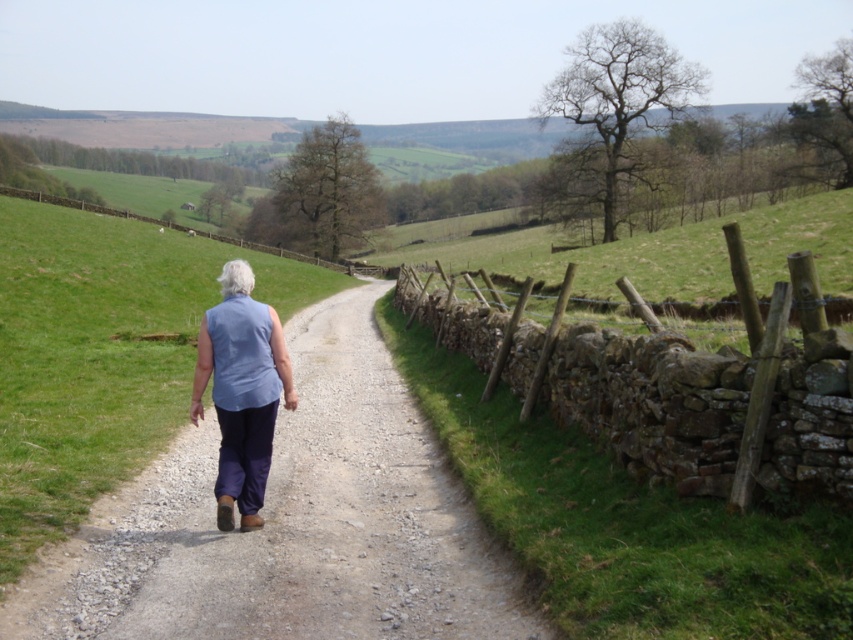
Based on the photo, who is more forward, (740,438) or (258,388)?

Point (740,438) is more forward.

Does brown stone fence at right lie in front of blue fabric at center?

That is True.

Who is more forward, (x=509, y=369) or (x=209, y=356)?

Positioned in front is point (x=209, y=356).

The height and width of the screenshot is (640, 853). Find the location of `brown stone fence at right`. brown stone fence at right is located at coordinates (663, 394).

Can you confirm if dusty gravel path at center is shorter than brown stone fence at right?

Yes, dusty gravel path at center is shorter than brown stone fence at right.

Does dusty gravel path at center have a smaller size compared to brown stone fence at right?

Correct, dusty gravel path at center occupies less space than brown stone fence at right.

Is point (442, 500) positioned before point (520, 321)?

That is True.

Identify the location of dusty gravel path at center. The width and height of the screenshot is (853, 640). [x=289, y=524].

The width and height of the screenshot is (853, 640). What do you see at coordinates (289, 524) in the screenshot?
I see `dusty gravel path at center` at bounding box center [289, 524].

Does dusty gravel path at center have a greater height compared to blue fabric at center?

No.

You are a GUI agent. You are given a task and a screenshot of the screen. Output one action in this format:
    pyautogui.click(x=<x>, y=<y>)
    Task: Click on the dusty gravel path at center
    The image size is (853, 640).
    Given the screenshot: What is the action you would take?
    pyautogui.click(x=289, y=524)